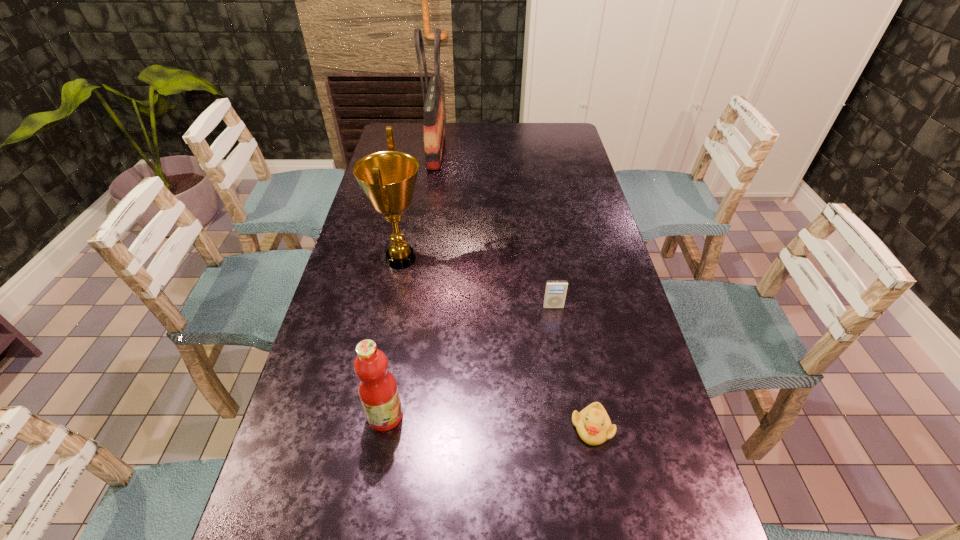
The height and width of the screenshot is (540, 960). What are the coordinates of `free spot located 0.090m on the front label of the third shortest object` in the screenshot? It's located at (444, 415).

Identify the location of free spot located 0.330m on the front-facing side of the iPod. Image resolution: width=960 pixels, height=540 pixels. (571, 421).

Locate an element on the screen. The width and height of the screenshot is (960, 540). free space located on the front-facing side of the shortest object is located at coordinates coord(600,471).

Find the location of a particular element. The image size is (960, 540). object that is positioned at the far edge is located at coordinates (434, 130).

You are a GUI agent. You are given a task and a screenshot of the screen. Output one action in this format:
    pyautogui.click(x=<x>, y=<y>)
    Task: Click on the object at the left edge
    This screenshot has width=960, height=540.
    Given the screenshot: What is the action you would take?
    pos(388,178)

Locate an element on the screen. object located at the right edge is located at coordinates (593, 425).

You are a GUI agent. You are given a task and a screenshot of the screen. Output one action in this format:
    pyautogui.click(x=<x>, y=<y>)
    Task: Click on the vacant space at the far edge of the desktop
    The image size is (960, 540).
    Given the screenshot: What is the action you would take?
    pyautogui.click(x=460, y=127)

You are a GUI agent. You are given a task and a screenshot of the screen. Output one action in this format:
    pyautogui.click(x=<x>, y=<y>)
    Task: Click on the free spot at the left edge of the desktop
    The width and height of the screenshot is (960, 540).
    Given the screenshot: What is the action you would take?
    pyautogui.click(x=302, y=470)

Find the location of `free space at the right edge`. free space at the right edge is located at coordinates (609, 291).

Locate an element on the screen. This screenshot has width=960, height=540. blank region between the fourth shortest object and the second shortest object is located at coordinates (477, 283).